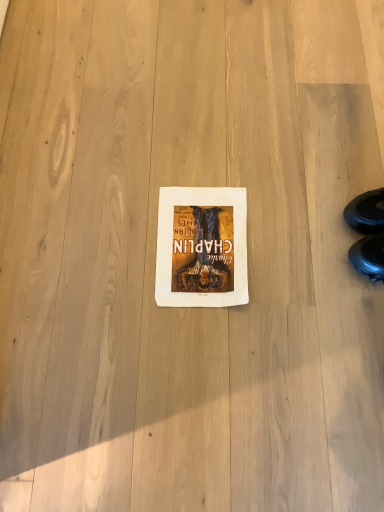
Identify the location of vacant region above white paper at center (from a real-world perspective). The width and height of the screenshot is (384, 512). (194, 238).